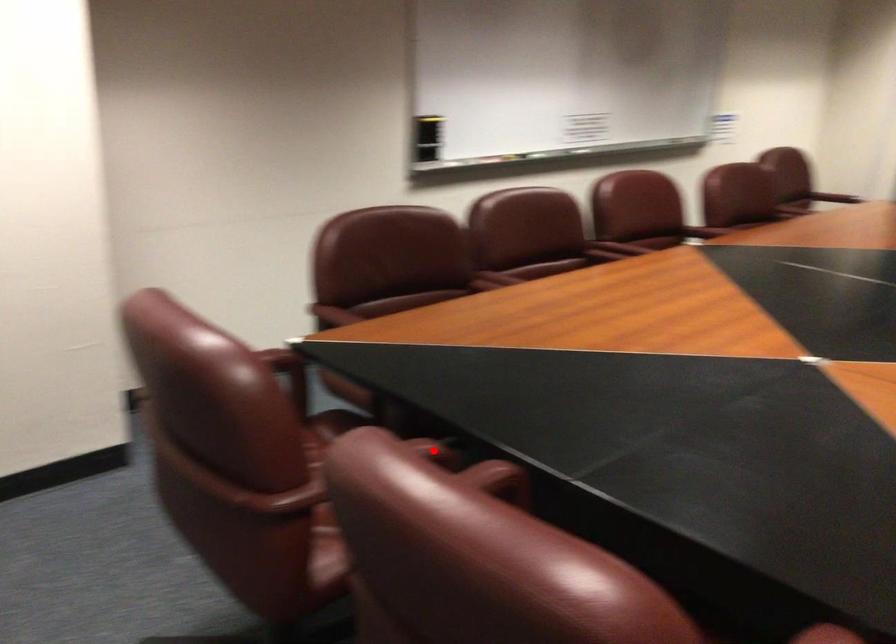
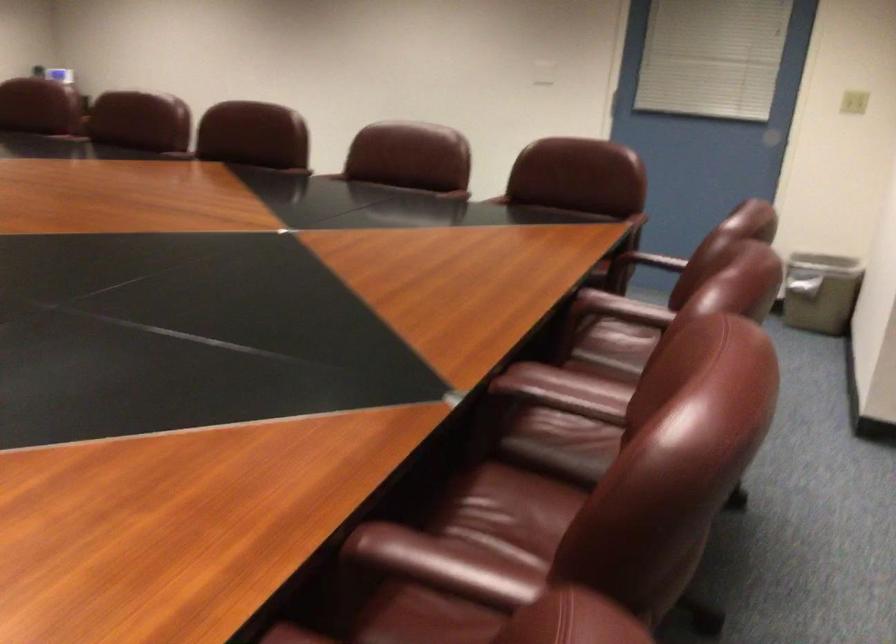
Question: I am providing you with two images of the same scene from different viewpoints. A red point is marked on the first image. Is the red point's position out of view in image 2?

Choices:
 (A) Yes
 (B) No

Answer: (A)